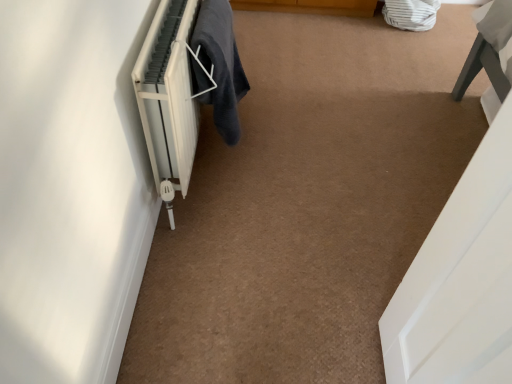
Question: Is white matte radiator at left beside dark gray fabric at lower left?

Choices:
 (A) no
 (B) yes

Answer: (A)

Question: Does white matte radiator at left lie in front of dark gray fabric at lower left?

Choices:
 (A) yes
 (B) no

Answer: (A)

Question: Is white matte radiator at left bigger than dark gray fabric at lower left?

Choices:
 (A) yes
 (B) no

Answer: (A)

Question: Is white matte radiator at left thinner than dark gray fabric at lower left?

Choices:
 (A) no
 (B) yes

Answer: (A)

Question: From the image's perspective, would you say white matte radiator at left is shown under dark gray fabric at lower left?

Choices:
 (A) no
 (B) yes

Answer: (B)

Question: Is white matte radiator at left wider than dark gray fabric at lower left?

Choices:
 (A) no
 (B) yes

Answer: (B)

Question: Considering the relative positions of dark gray fabric at lower left and white matte radiator at left in the image provided, is dark gray fabric at lower left to the right of white matte radiator at left from the viewer's perspective?

Choices:
 (A) no
 (B) yes

Answer: (B)

Question: Can you confirm if dark gray fabric at lower left is wider than white matte radiator at left?

Choices:
 (A) no
 (B) yes

Answer: (A)

Question: Is dark gray fabric at lower left shorter than white matte radiator at left?

Choices:
 (A) yes
 (B) no

Answer: (A)

Question: Is dark gray fabric at lower left bigger than white matte radiator at left?

Choices:
 (A) yes
 (B) no

Answer: (B)

Question: From the image's perspective, does dark gray fabric at lower left appear lower than white matte radiator at left?

Choices:
 (A) yes
 (B) no

Answer: (B)

Question: Is dark gray fabric at lower left outside white matte radiator at left?

Choices:
 (A) no
 (B) yes

Answer: (A)

Question: In terms of height, does white matte radiator at left look taller or shorter compared to dark gray fabric at lower left?

Choices:
 (A) short
 (B) tall

Answer: (B)